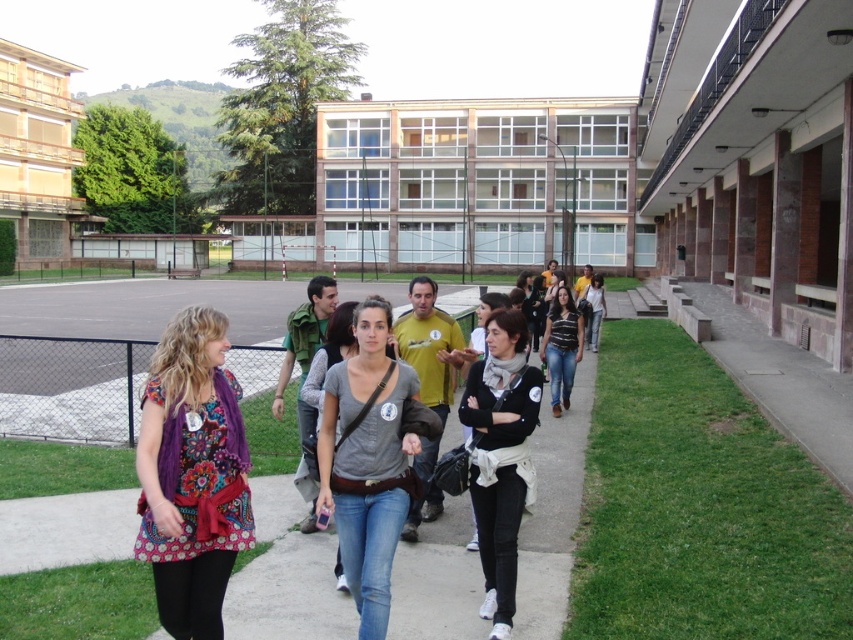
Question: Does green grass at lower right have a lesser width compared to floral print dress at center?

Choices:
 (A) no
 (B) yes

Answer: (A)

Question: Is floral print dress at center thinner than black matte jacket at center?

Choices:
 (A) no
 (B) yes

Answer: (A)

Question: Which point is farther to the camera?

Choices:
 (A) (331, 396)
 (B) (808, 518)
 (C) (286, 496)

Answer: (C)

Question: Is floral print dress at center smaller than gray cotton t-shirt at center?

Choices:
 (A) no
 (B) yes

Answer: (B)

Question: Estimate the real-world distances between objects in this image. Which object is farther from the floral print dress at center?

Choices:
 (A) black matte jacket at center
 (B) gray cotton t-shirt at center

Answer: (A)

Question: Among these objects, which one is farthest from the camera?

Choices:
 (A) floral print dress at center
 (B) jeans at center
 (C) black matte jacket at center

Answer: (B)